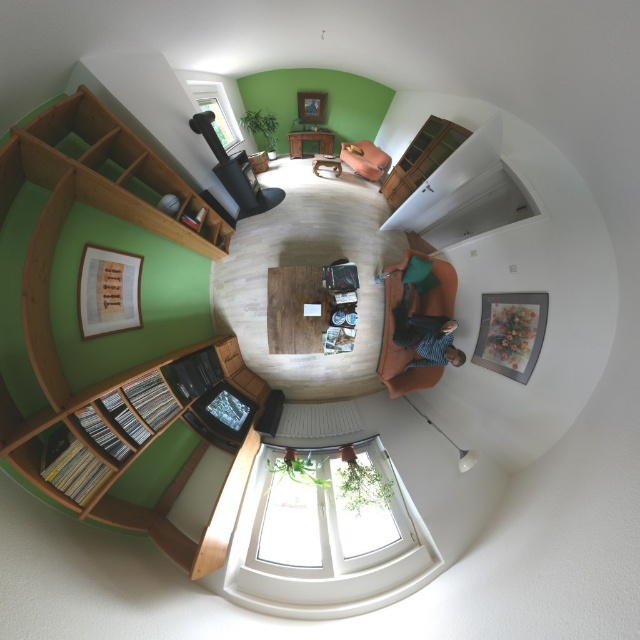
Question: Is white glass window at lower center above wooden table at center?

Choices:
 (A) no
 (B) yes

Answer: (A)

Question: Which point is farther from the camera taking this photo?

Choices:
 (A) (320, 269)
 (B) (428, 173)
 (C) (356, 170)

Answer: (C)

Question: Is wooden bookcase at lower left closer to the viewer compared to wooden bookshelf at upper right?

Choices:
 (A) no
 (B) yes

Answer: (B)

Question: Which is farther from the striped shirt at center?

Choices:
 (A) wooden at left
 (B) wooden table at center
 (C) wooden bookshelf at upper right

Answer: (A)

Question: Based on their relative distances, which object is nearer to the wooden at left?

Choices:
 (A) white glass window at lower center
 (B) wooden bookshelf at upper right

Answer: (A)

Question: Can you confirm if wooden bookcase at lower left is positioned to the left of wooden bookshelf at upper right?

Choices:
 (A) no
 (B) yes

Answer: (B)